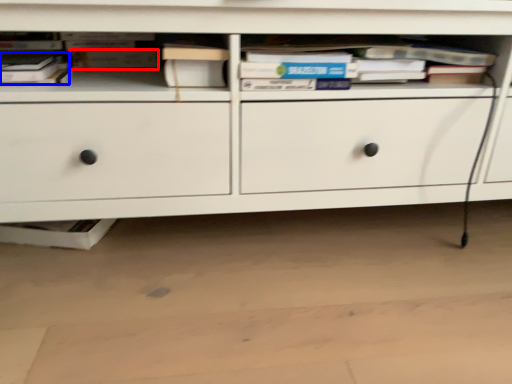
Question: Which of the following is the farthest to the observer, paperback book (highlighted by a red box) or book (highlighted by a blue box)?

Choices:
 (A) paperback book
 (B) book

Answer: (A)